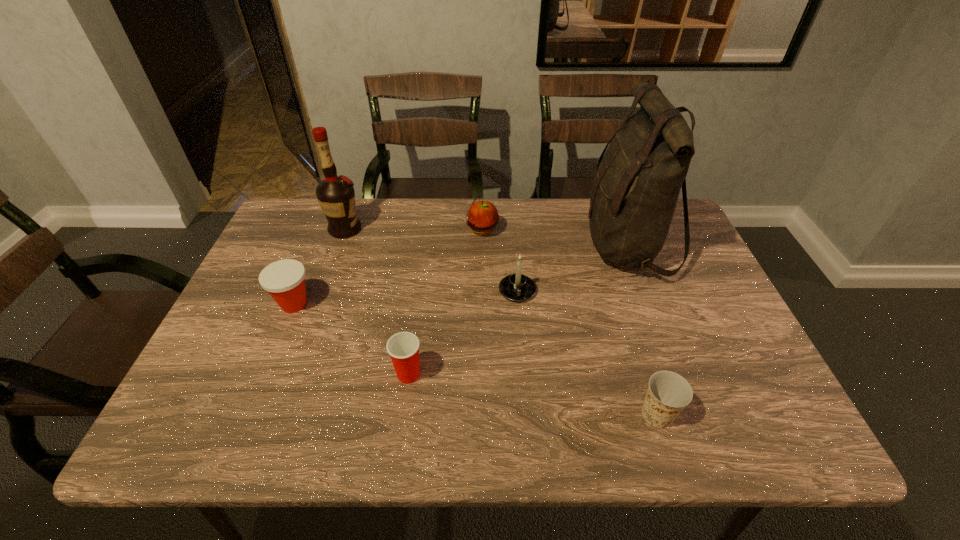
Locate an element on the screen. The image size is (960, 540). the tallest object is located at coordinates (635, 191).

This screenshot has height=540, width=960. In order to click on liquor in this screenshot , I will do `click(336, 196)`.

Find the location of a particular element. This screenshot has height=540, width=960. candle holder is located at coordinates (517, 287).

What are the coordinates of `apple` in the screenshot? It's located at (482, 217).

Where is `the farthest Dixie cup`? the farthest Dixie cup is located at coordinates (284, 280).

You are a GUI agent. You are given a task and a screenshot of the screen. Output one action in this format:
    pyautogui.click(x=<x>, y=<y>)
    Task: Click on the fifth object from right to left
    This screenshot has width=960, height=540.
    Given the screenshot: What is the action you would take?
    pyautogui.click(x=403, y=348)

Locate an element on the screen. the second Dixie cup from left to right is located at coordinates (403, 348).

Locate an element on the screen. This screenshot has height=540, width=960. the rightmost Dixie cup is located at coordinates (668, 393).

In order to click on the nearest object in this screenshot , I will do `click(668, 393)`.

The image size is (960, 540). I want to click on free space located on the open flap of the backpack, so click(490, 245).